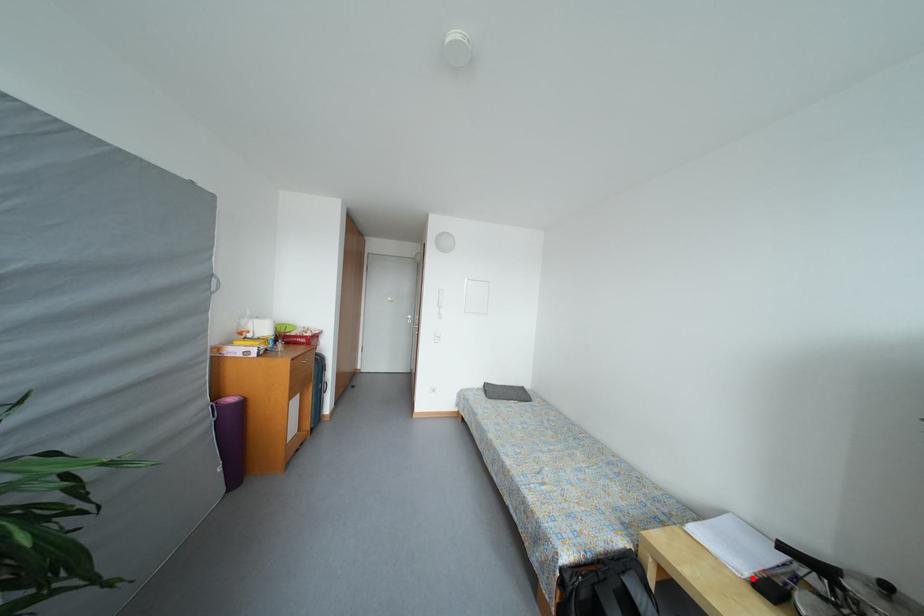
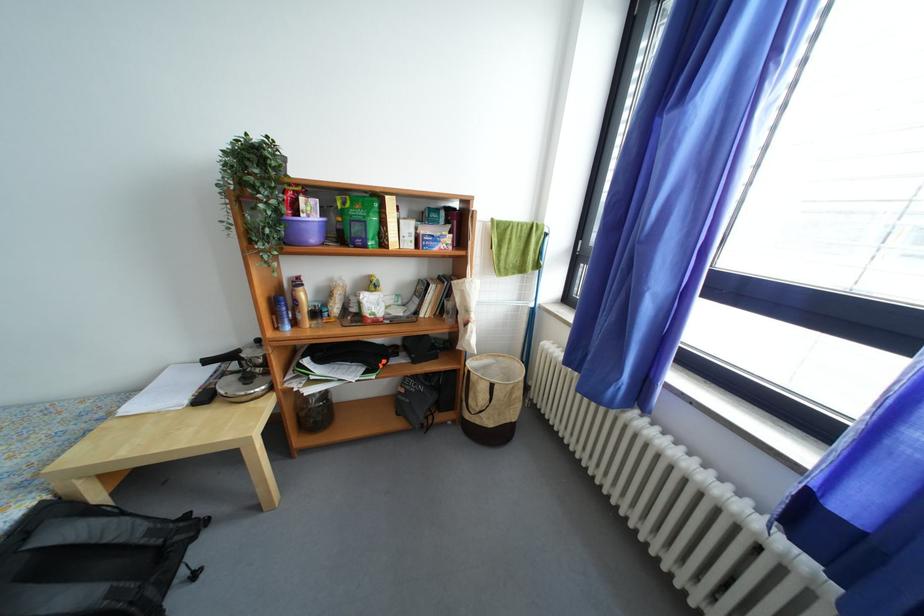
Where in the second image is the point corresponding to the highlighted location from the first image?

(192, 406)